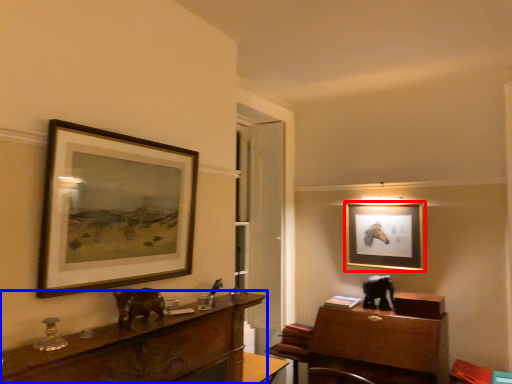
Question: Which object is closer to the camera taking this photo, picture frame (highlighted by a red box) or desk (highlighted by a blue box)?

Choices:
 (A) picture frame
 (B) desk

Answer: (B)